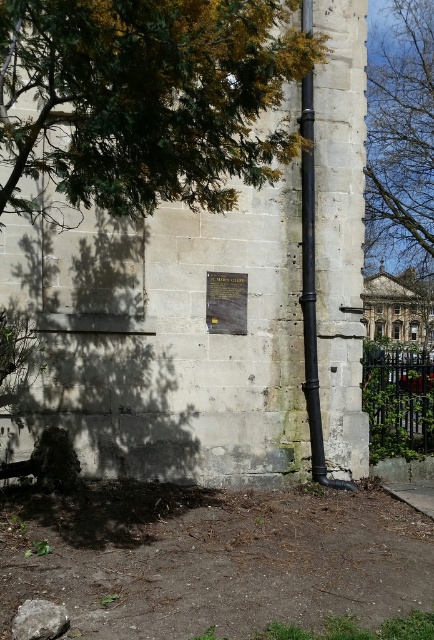
Does black metal fence at lower right appear under black matte pipe at right?

Yes, black metal fence at lower right is below black matte pipe at right.

The height and width of the screenshot is (640, 434). Find the location of `black metal fence at lower right`. black metal fence at lower right is located at coordinates point(397,401).

Is point (382, 417) positioned in front of point (303, 122)?

No, it is behind (303, 122).

The height and width of the screenshot is (640, 434). Find the location of `black metal fence at lower right`. black metal fence at lower right is located at coordinates (397, 401).

Can you confirm if black matte pipe at right is positioned to the right of matte brown stone plaque at center?

Indeed, black matte pipe at right is positioned on the right side of matte brown stone plaque at center.

Measure the distance between black matte pipe at right and camera.

black matte pipe at right and camera are 7.95 meters apart from each other.

Who is more forward, (x=302, y=212) or (x=240, y=284)?

Positioned in front is point (x=240, y=284).

Locate an element on the screen. black matte pipe at right is located at coordinates (309, 285).

Does green leafy tree at upper center have a larger size compared to black metal fence at lower right?

Yes.

This screenshot has width=434, height=640. Find the location of `green leafy tree at upper center`. green leafy tree at upper center is located at coordinates (401, 134).

Where is `green leafy tree at upper center`? The image size is (434, 640). green leafy tree at upper center is located at coordinates (401, 134).